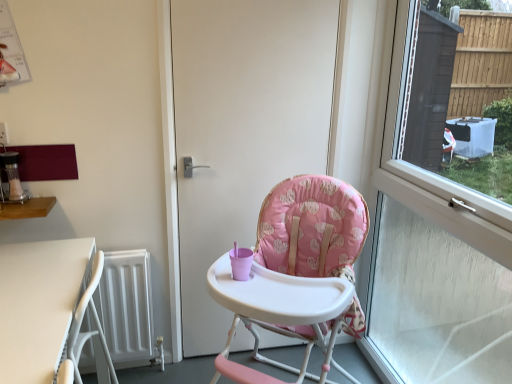
Question: In terms of width, does pink fabric highchair at center look wider or thinner when compared to white matte door at center?

Choices:
 (A) wide
 (B) thin

Answer: (A)

Question: Visually, is pink fabric highchair at center positioned to the left or to the right of white matte door at center?

Choices:
 (A) left
 (B) right

Answer: (B)

Question: Which is farther from the white matte radiator at lower left?

Choices:
 (A) white plastic table at lower left, the 1th table ordered from the bottom
 (B) white matte door at center
 (C) pink fabric highchair at center
 (D) transparent glass window at right
 (E) wooden table at left, which ranks as the first table in top-to-bottom order

Answer: (D)

Question: Which of these objects is positioned closest to the wooden table at left, which ranks as the first table in top-to-bottom order?

Choices:
 (A) pink fabric highchair at center
 (B) white plastic table at lower left, the 2th table when ordered from top to bottom
 (C) transparent glass window at right
 (D) white matte radiator at lower left
 (E) white matte door at center

Answer: (B)